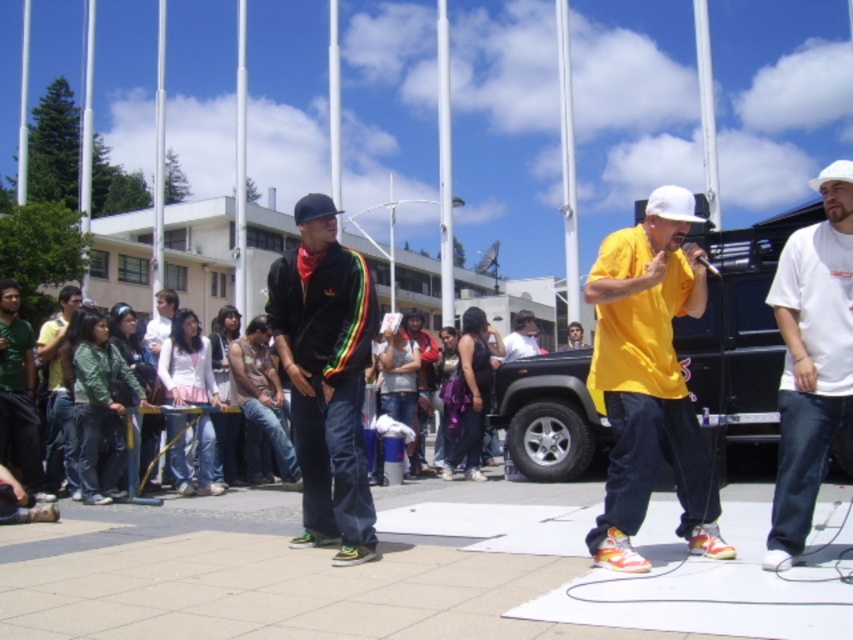
Question: Is matte yellow t-shirt at center above white cotton t-shirt at right?

Choices:
 (A) yes
 (B) no

Answer: (A)

Question: Is white cotton t-shirt at right below green denim jacket at lower left?

Choices:
 (A) yes
 (B) no

Answer: (B)

Question: Does matte black jacket at center have a larger size compared to green matte shirt at lower left?

Choices:
 (A) yes
 (B) no

Answer: (A)

Question: Which of these objects is positioned farthest from the black matte jeep at center?

Choices:
 (A) matte yellow t-shirt at center
 (B) green matte shirt at lower left

Answer: (B)

Question: Estimate the real-world distances between objects in this image. Which object is closer to the green matte shirt at lower left?

Choices:
 (A) white cotton t-shirt at right
 (B) green denim jacket at lower left
 (C) matte yellow t-shirt at center
 (D) black matte jeep at center

Answer: (B)

Question: Which point appears farthest from the camera in this image?

Choices:
 (A) (517, 364)
 (B) (700, 276)
 (C) (28, 481)

Answer: (A)